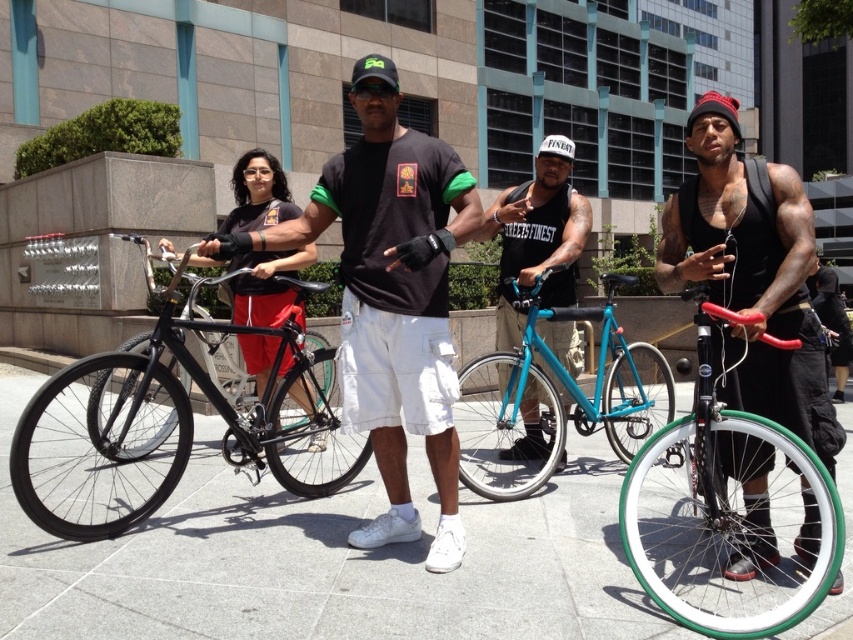
Between matte black t-shirt at center and green rubber bicycle at right, which one appears on the left side from the viewer's perspective?

matte black t-shirt at center

Does matte black t-shirt at center appear on the left side of green rubber bicycle at right?

Correct, you'll find matte black t-shirt at center to the left of green rubber bicycle at right.

Find the location of a particular element. matte black t-shirt at center is located at coordinates (392, 298).

Can you confirm if black matte bicycle at left is smaller than matte blue bicycle at center?

No.

How distant is black matte bicycle at left from matte blue bicycle at center?

They are 7.35 feet apart.

Measure the distance between black matte bicycle at left and camera.

The distance of black matte bicycle at left from camera is 3.47 meters.

You are a GUI agent. You are given a task and a screenshot of the screen. Output one action in this format:
    pyautogui.click(x=<x>, y=<y>)
    Task: Click on the black matte bicycle at left
    
    Given the screenshot: What is the action you would take?
    pyautogui.click(x=160, y=428)

Does gray concrete pavement at center have a greater width compared to matte black t-shirt at center?

Yes, gray concrete pavement at center is wider than matte black t-shirt at center.

Locate an element on the screen. gray concrete pavement at center is located at coordinates (325, 561).

Describe the element at coordinates (325, 561) in the screenshot. I see `gray concrete pavement at center` at that location.

I want to click on gray concrete pavement at center, so click(325, 561).